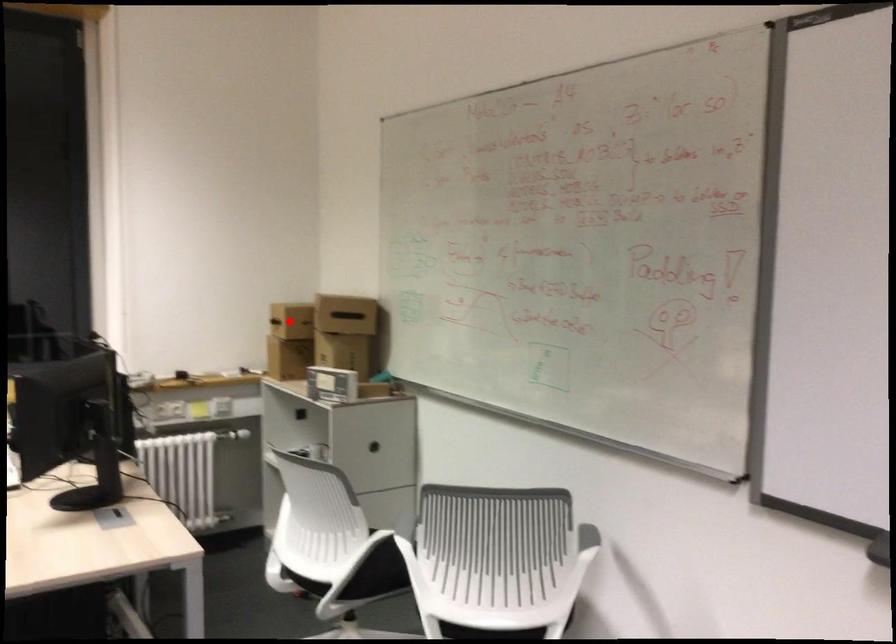
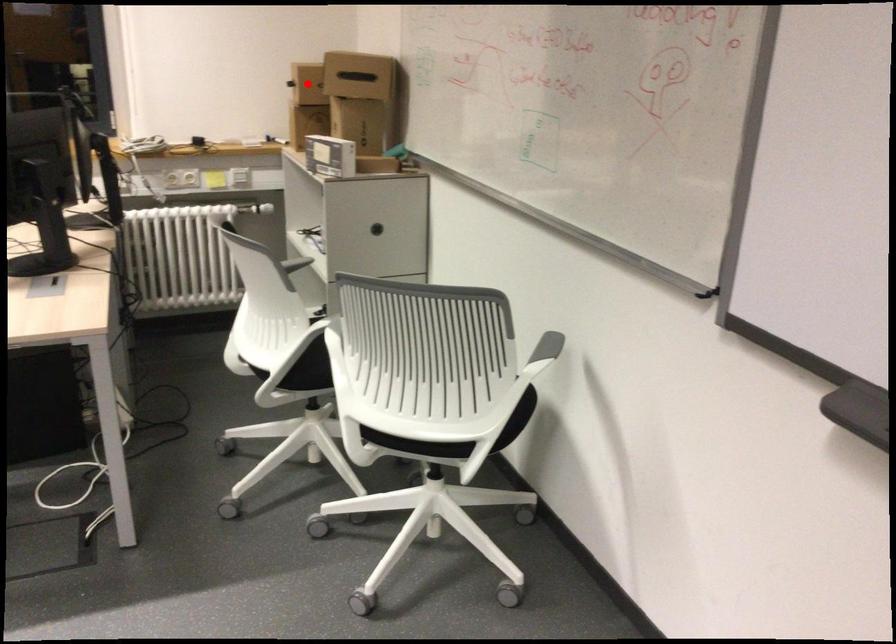
From the picture: I am providing you with two images of the same scene from different viewpoints. A red point is marked on the first image and another point is marked on the second image. Is the marked point in image1 the same physical position as the marked point in image2?

Yes